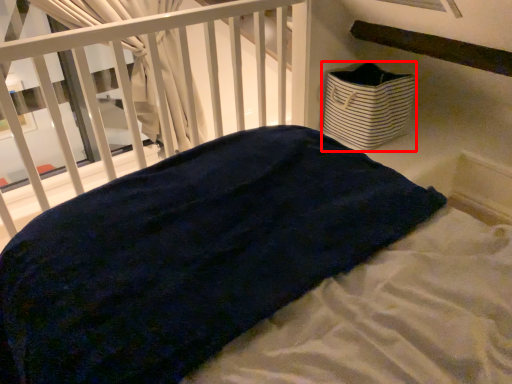
Question: From the image, what is the correct spatial relationship of basket (annotated by the red box) in relation to infant bed?

Choices:
 (A) right
 (B) left

Answer: (A)